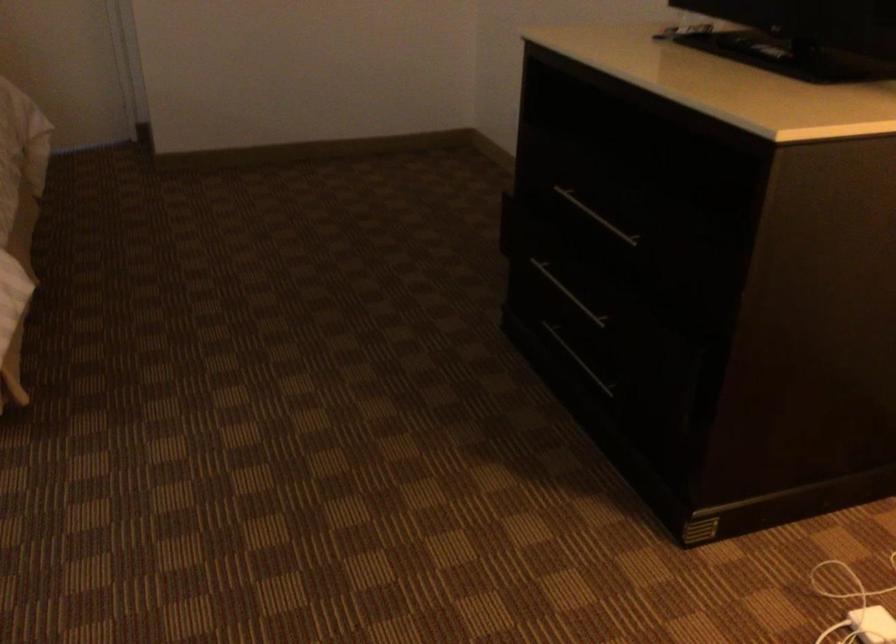
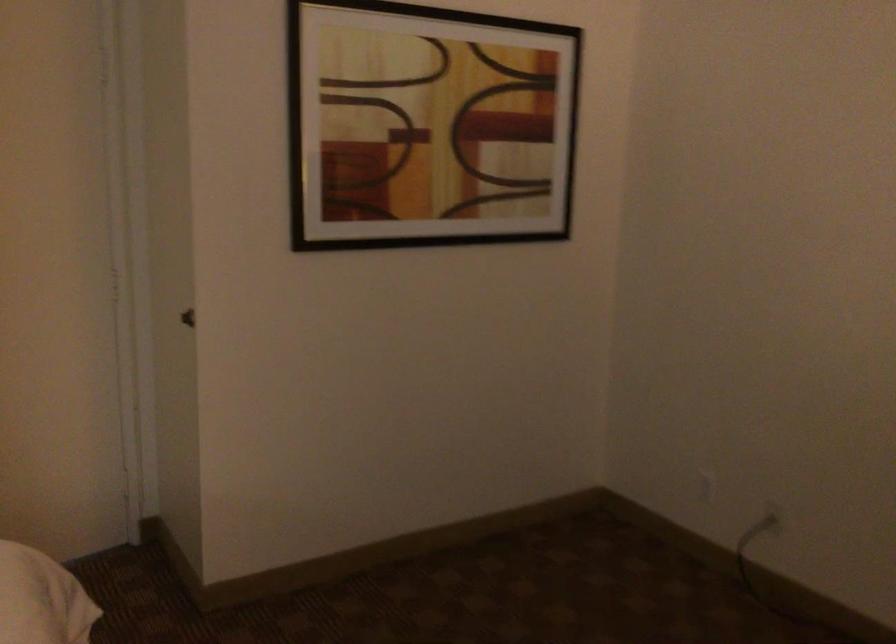
Which direction would the cameraman need to move to produce the second image?

The movement direction of the cameraman is left, forward.